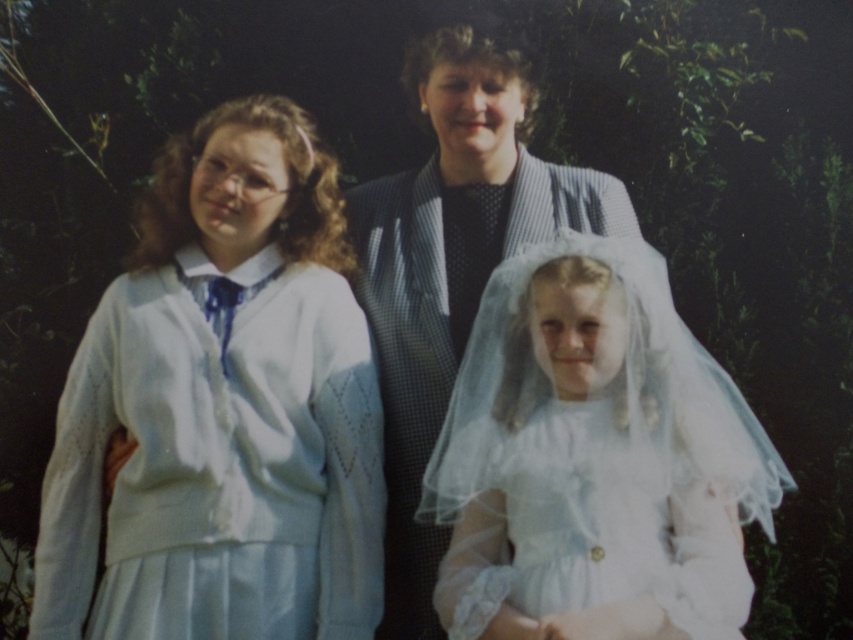
Can you confirm if white sheer veil at center is taller than white satin dress at center?

Yes, white sheer veil at center is taller than white satin dress at center.

Does point (538, 456) come in front of point (601, 588)?

No, (538, 456) is further to viewer.

Who is more forward, (x=598, y=340) or (x=627, y=595)?

Point (x=627, y=595) is in front.

Where is `white sheer veil at center`? white sheer veil at center is located at coordinates (595, 460).

Does white knitted dress at left have a larger size compared to matte gray suit at center?

No, white knitted dress at left is not bigger than matte gray suit at center.

Can you confirm if white knitted dress at left is taller than matte gray suit at center?

In fact, white knitted dress at left may be shorter than matte gray suit at center.

Measure the distance between white knitted dress at left and camera.

white knitted dress at left is 2.41 meters away from camera.

The image size is (853, 640). What are the coordinates of `white knitted dress at left` in the screenshot? It's located at (218, 461).

Measure the distance between white knitted dress at left and white satin dress at center.

They are 25.19 inches apart.

Is the position of white knitted dress at left more distant than that of white satin dress at center?

Yes, it is.

Who is more distant from viewer, (252, 528) or (512, 484)?

Point (252, 528)

This screenshot has height=640, width=853. Find the location of `white knitted dress at left`. white knitted dress at left is located at coordinates (218, 461).